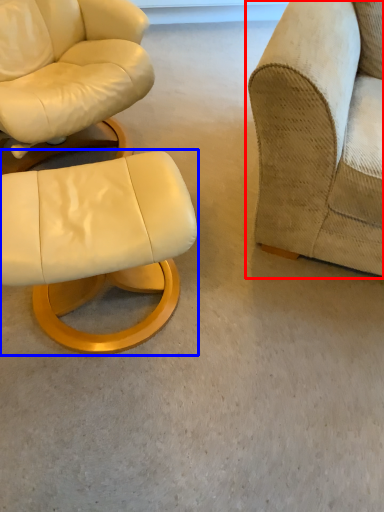
Question: Which of the following is the farthest to the observer, studio couch (highlighted by a red box) or chair (highlighted by a blue box)?

Choices:
 (A) studio couch
 (B) chair

Answer: (B)